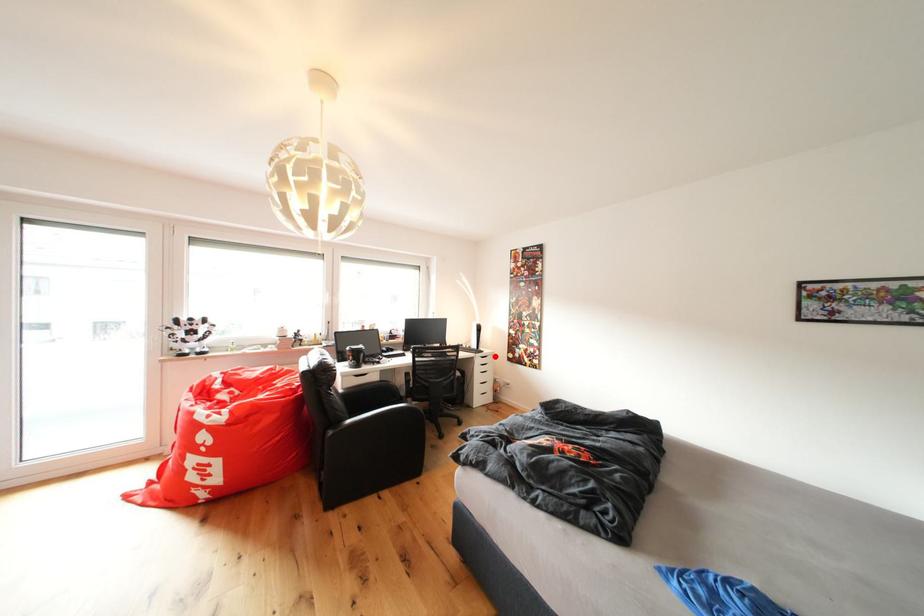
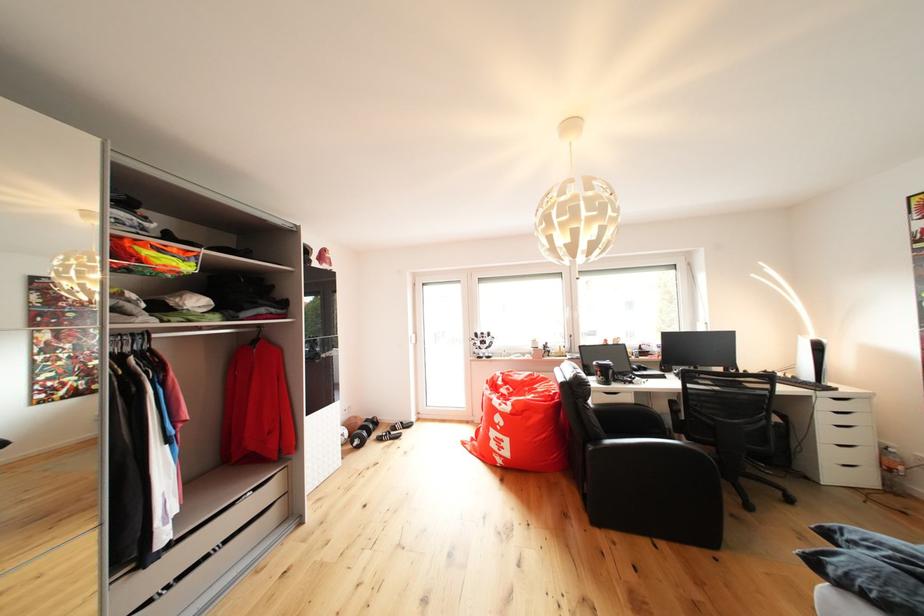
Locate, in the second image, the point that corresponds to the highlighted location in the first image.

(855, 395)